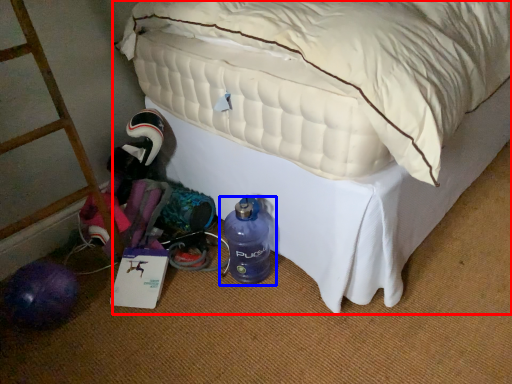
Question: Which object appears farthest to the camera in this image, bed (highlighted by a red box) or bottle (highlighted by a blue box)?

Choices:
 (A) bed
 (B) bottle

Answer: (B)